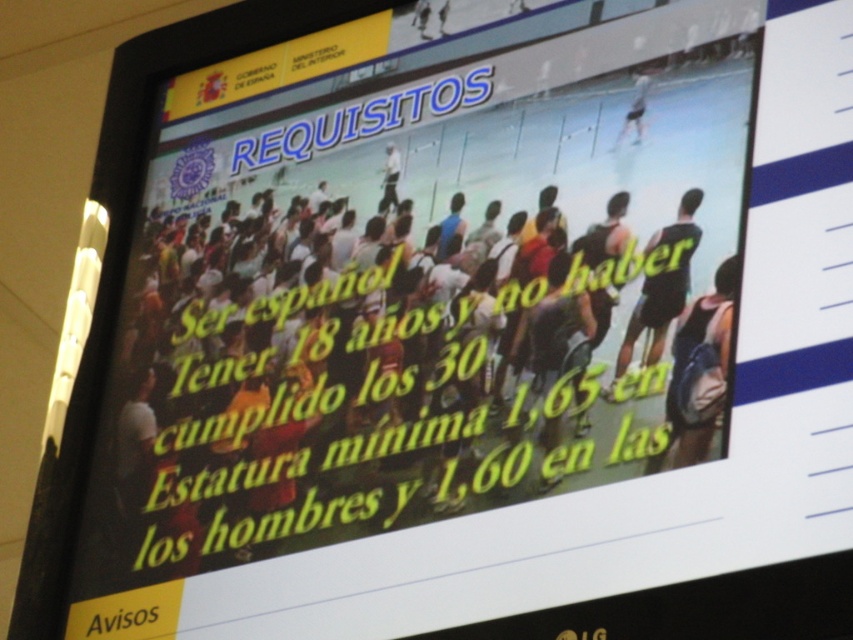
Is point (613, 241) closer to camera compared to point (630, 116)?

Yes, it is in front of point (630, 116).

Is matte black backpack at center to the left of light blue fabric shorts at upper right from the viewer's perspective?

Yes, matte black backpack at center is to the left of light blue fabric shorts at upper right.

Between point (234, 504) and point (637, 128), which one is positioned in front?

Positioned in front is point (637, 128).

This screenshot has width=853, height=640. Find the location of `matte black backpack at center`. matte black backpack at center is located at coordinates (393, 378).

Who is positioned more to the right, dark blue athletic shorts at center or light blue fabric shorts at upper right?

dark blue athletic shorts at center is more to the right.

Which is behind, point (647, 353) or point (647, 88)?

Point (647, 88)

Where is `dark blue athletic shorts at center`? This screenshot has height=640, width=853. dark blue athletic shorts at center is located at coordinates (662, 284).

This screenshot has width=853, height=640. What are the coordinates of `dark blue athletic shorts at center` in the screenshot? It's located at (662, 284).

Can you confirm if matte black backpack at center is thinner than dark blue athletic shorts at center?

Incorrect, matte black backpack at center's width is not less than dark blue athletic shorts at center's.

This screenshot has width=853, height=640. In order to click on matte black backpack at center in this screenshot , I will do `click(393, 378)`.